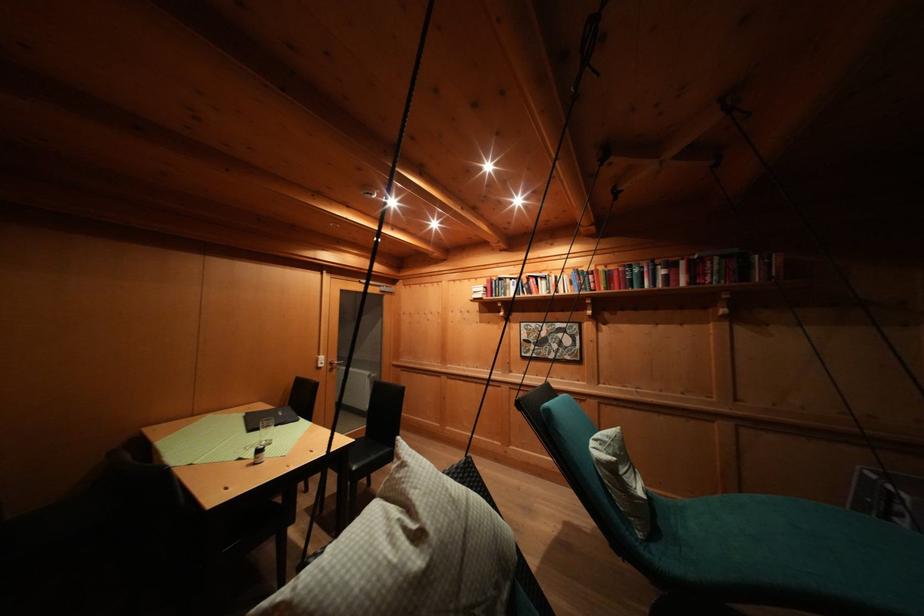
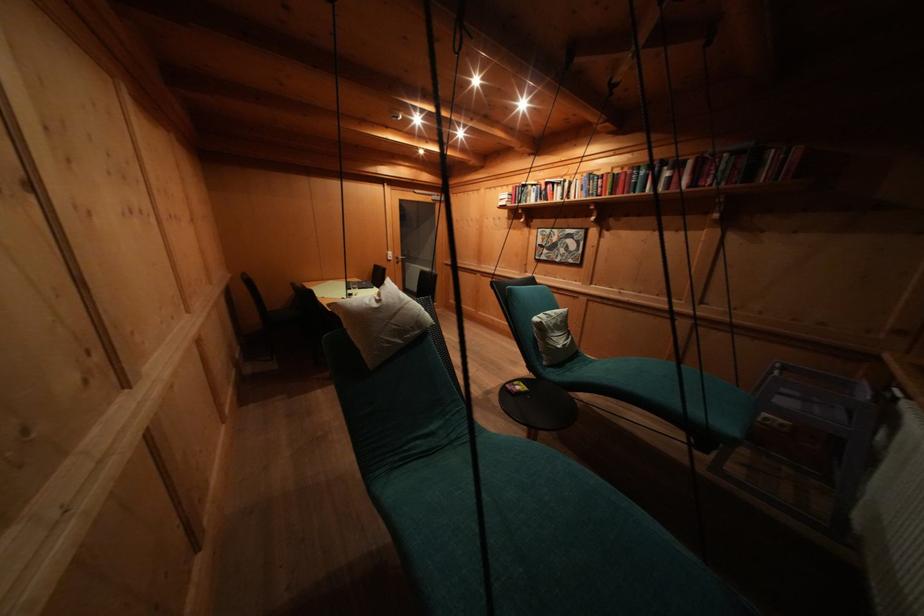
In a continuous first-person perspective shot, in which direction is the camera moving?

The cameraman walked toward right, backward.